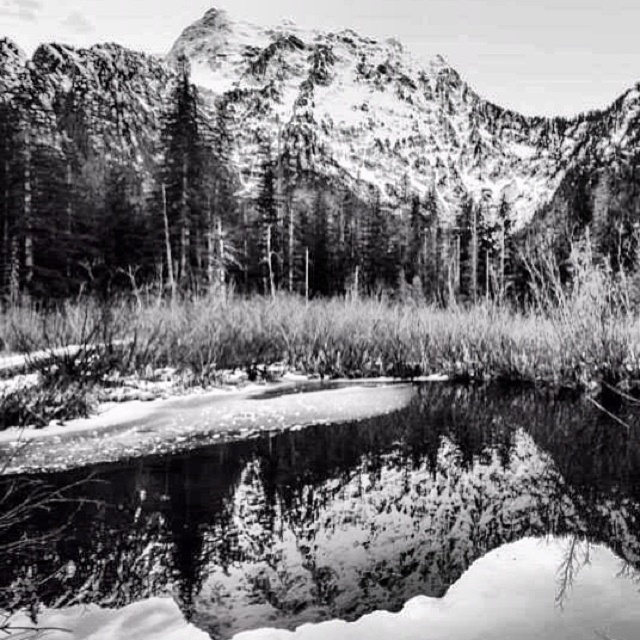
Question: Which point appears farthest from the camera in this image?

Choices:
 (A) (380, 454)
 (B) (529, 248)

Answer: (B)

Question: Is rugged stone mountain at upper center to the right of smooth ice at center from the viewer's perspective?

Choices:
 (A) yes
 (B) no

Answer: (B)

Question: Considering the relative positions of rugged stone mountain at upper center and smooth ice at center in the image provided, where is rugged stone mountain at upper center located with respect to smooth ice at center?

Choices:
 (A) left
 (B) right

Answer: (A)

Question: Considering the relative positions of rugged stone mountain at upper center and smooth ice at center in the image provided, where is rugged stone mountain at upper center located with respect to smooth ice at center?

Choices:
 (A) below
 (B) above

Answer: (B)

Question: Which of the following is the farthest from the observer?

Choices:
 (A) smooth ice at center
 (B) rugged stone mountain at upper center

Answer: (B)